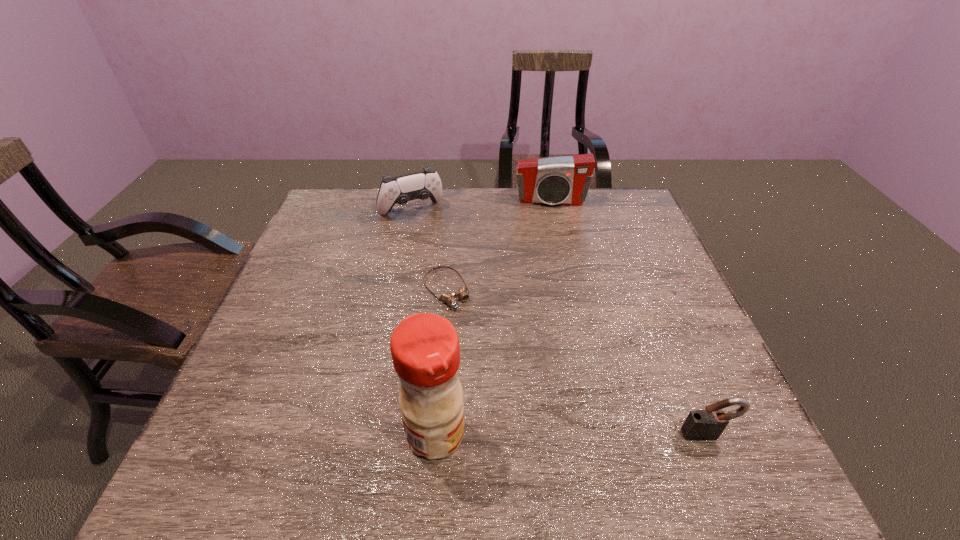
Identify the location of free space on the desktop that is between the tallest object and the padlock and is positioned on the front lenses and sides of the goggles. The image size is (960, 540). (560, 434).

The image size is (960, 540). In order to click on vacant spot on the desktop that is between the condiment and the rightmost object and is positioned on the front-facing side of the control in this screenshot , I will do pyautogui.click(x=547, y=434).

Find the location of a particular element. The height and width of the screenshot is (540, 960). vacant space on the desktop that is between the tallest object and the padlock and is positioned on the front-facing side of the fourth object from left to right is located at coordinates (574, 434).